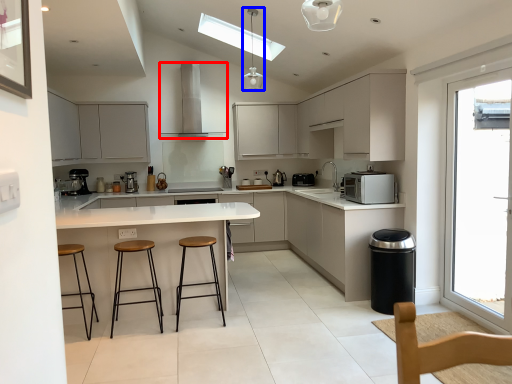
Question: Which object appears closest to the camera in this image, home appliance (highlighted by a red box) or light fixture (highlighted by a blue box)?

Choices:
 (A) home appliance
 (B) light fixture

Answer: (B)